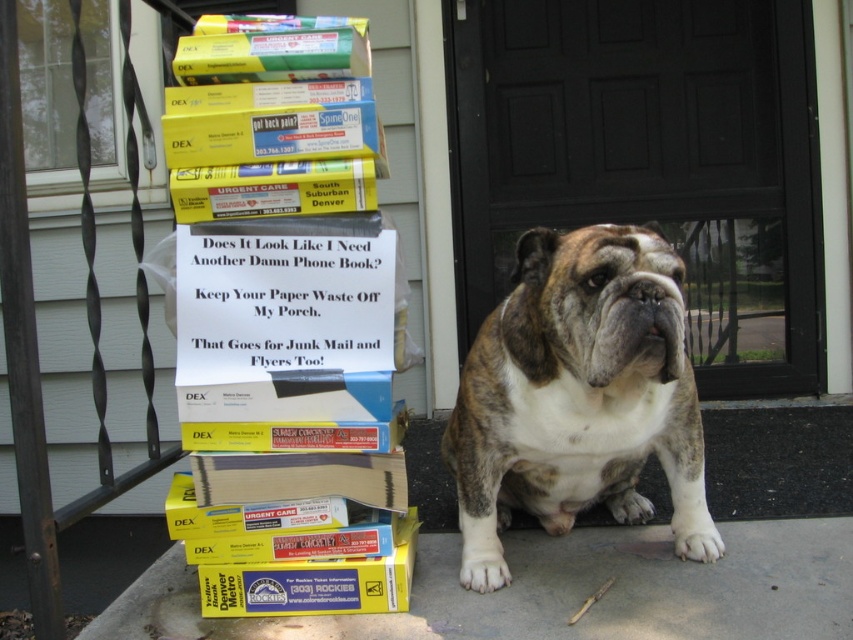
How much distance is there between yellow paper sign at center and yellow matte box at lower left?

yellow paper sign at center is 8.10 inches from yellow matte box at lower left.

Who is higher up, yellow paper sign at center or yellow matte box at lower left?

yellow paper sign at center

Which is in front, point (392, 493) or point (230, 580)?

Point (392, 493) is in front.

Where is `yellow paper sign at center`? The height and width of the screenshot is (640, 853). yellow paper sign at center is located at coordinates (291, 390).

Does brown fur at center appear on the right side of yellow matte box at lower left?

Yes, brown fur at center is to the right of yellow matte box at lower left.

How much distance is there between brown fur at center and yellow matte box at lower left?

brown fur at center and yellow matte box at lower left are 52.41 centimeters apart.

This screenshot has width=853, height=640. Identify the location of brown fur at center. (596, 305).

In order to click on brown fur at center in this screenshot , I will do [596, 305].

Is brown/white fur at center positioned before yellow matte box at lower left?

Yes, brown/white fur at center is closer to the viewer.

Is brown/white fur at center taller than yellow matte box at lower left?

Correct, brown/white fur at center is much taller as yellow matte box at lower left.

In the scene shown: Who is more forward, (543,291) or (230,568)?

Point (543,291)

This screenshot has height=640, width=853. What are the coordinates of `brown/white fur at center` in the screenshot? It's located at (578, 396).